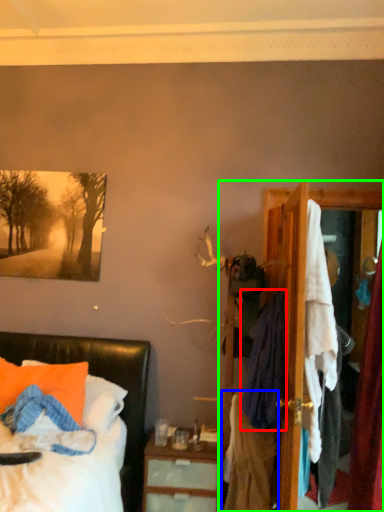
Question: Estimate the real-world distances between objects in this image. Which object is closer to clothing (highlighted by a red box), clothing (highlighted by a blue box) or dresser (highlighted by a green box)?

Choices:
 (A) clothing
 (B) dresser

Answer: (B)